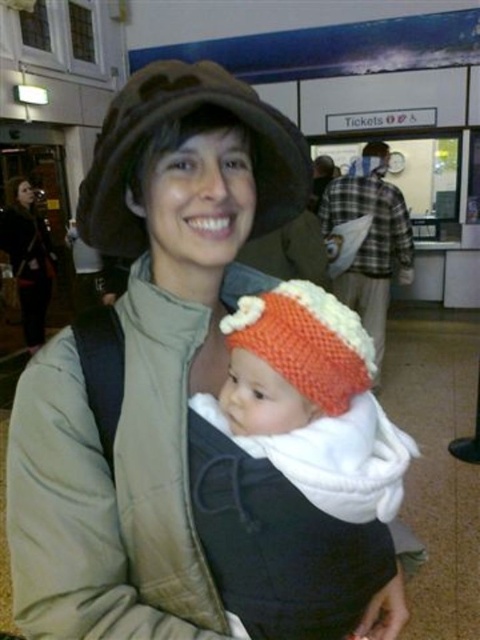
Question: Is knitted orange hat at center positioned at the back of matte black camera at upper left?

Choices:
 (A) no
 (B) yes

Answer: (A)

Question: Which object appears farthest from the camera in this image?

Choices:
 (A) brown fuzzy hat at upper center
 (B) matte black camera at upper left

Answer: (B)

Question: Which point is farther to the camera?

Choices:
 (A) brown fuzzy hat at upper center
 (B) knitted orange hat at center
 (C) matte black camera at upper left

Answer: (C)

Question: Can you confirm if knitted orange hat at center is wider than matte black camera at upper left?

Choices:
 (A) no
 (B) yes

Answer: (A)

Question: Which of these objects is positioned farthest from the knitted orange hat at center?

Choices:
 (A) brown fuzzy hat at upper center
 (B) matte black camera at upper left

Answer: (B)

Question: Does knitted orange hat at center have a greater width compared to matte black camera at upper left?

Choices:
 (A) yes
 (B) no

Answer: (B)